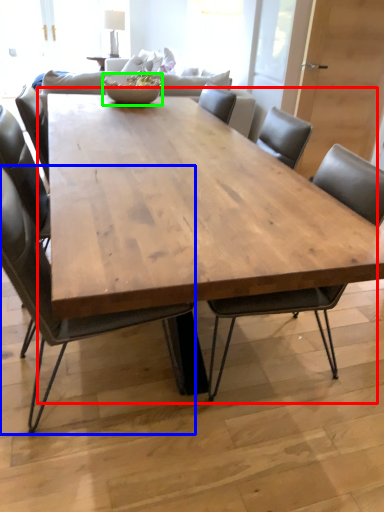
Question: Which object is the closest to the coffee table (highlighted by a red box)? Choose among these: chair (highlighted by a blue box) or bowl (highlighted by a green box).

Choices:
 (A) chair
 (B) bowl

Answer: (A)